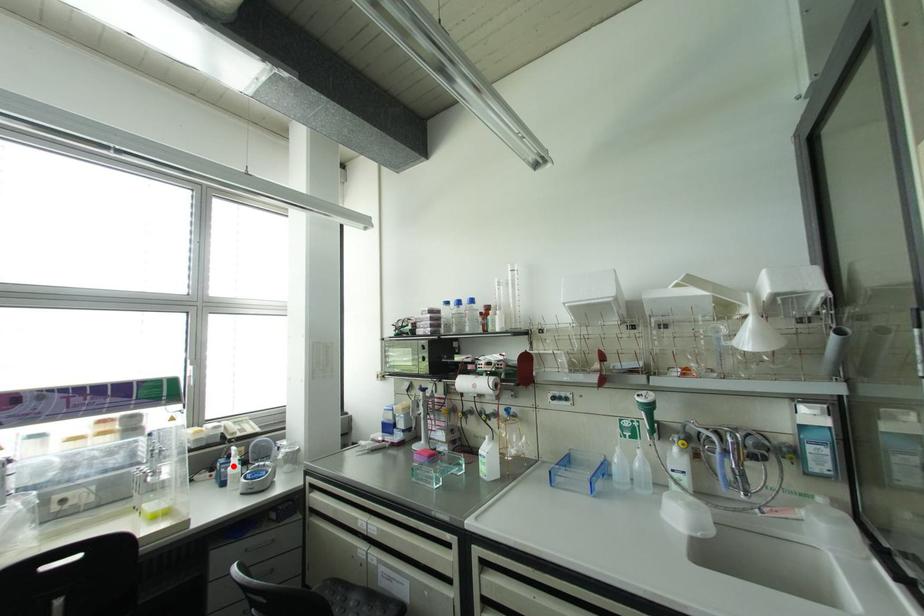
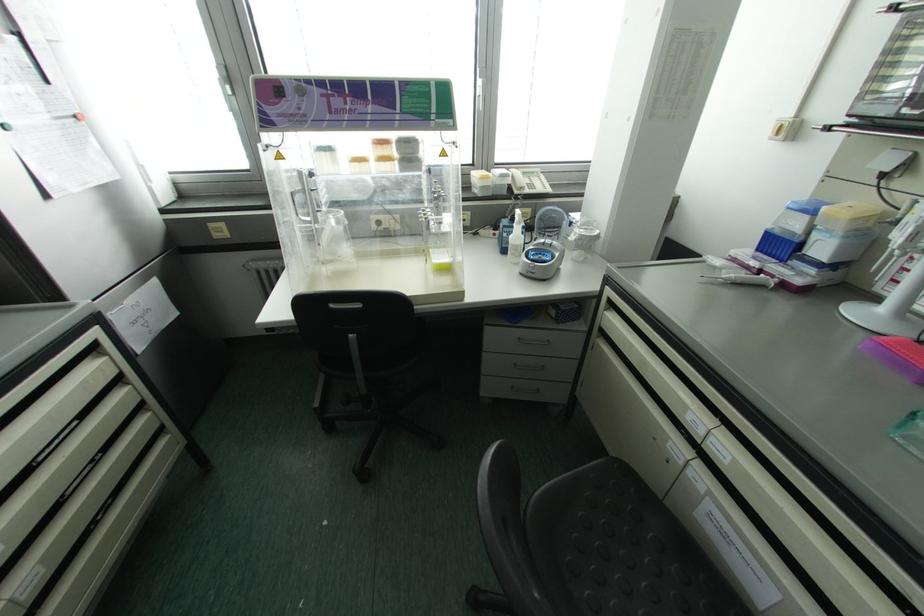
In the second image, find the point that corresponds to the highlighted location in the first image.

(516, 235)